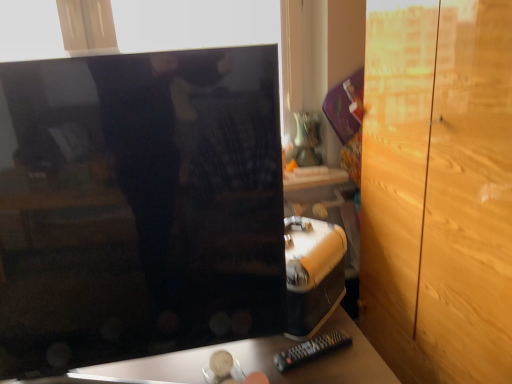
Identify the location of free point to the right of black plastic remote at lower center. The height and width of the screenshot is (384, 512). (360, 359).